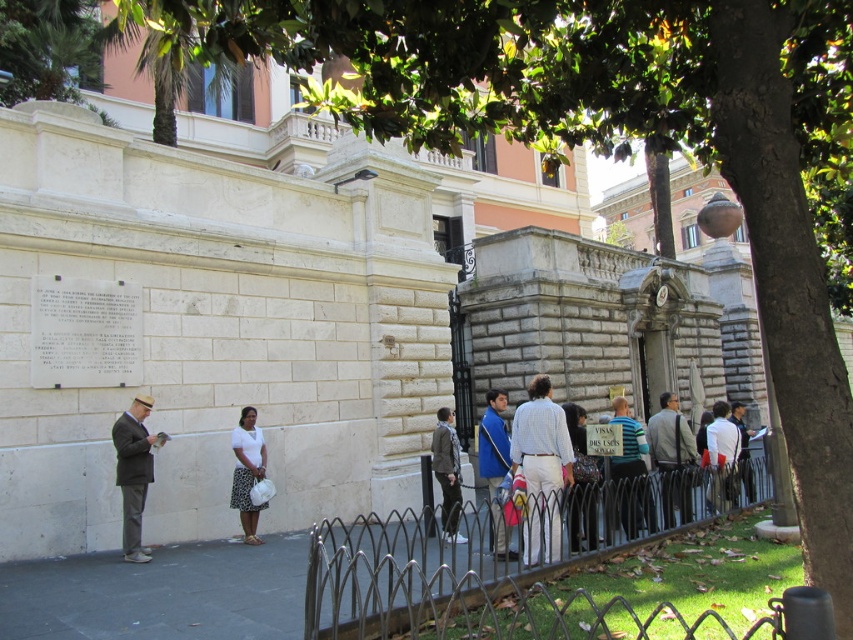
You are a photographer standing in front of the historic building. You notice the white matte skirt at center and the gray wool coat at center in your frame. Which object should you adjust your camera angle to focus on if you want to capture the taller object?

The white matte skirt at center is much taller than the gray wool coat at center, so you should focus on the white matte skirt at center to capture the taller object.

You are standing at the entrance of the historic building and see the light brown leather jacket at center. If you walk straight ahead, will you move closer to the jacket or further away from it?

The light brown leather jacket at center is located at point (672, 458). Since you are at the entrance, walking straight ahead would move you away from the jacket as it is positioned further along the path from the entrance.

You are a photographer standing in front of the historic building and see the light blue striped shirt at center and the gray wool coat at center. Which clothing item is closer to the camera?

The light blue striped shirt at center is shorter than the gray wool coat at center, so it is closer to the camera.